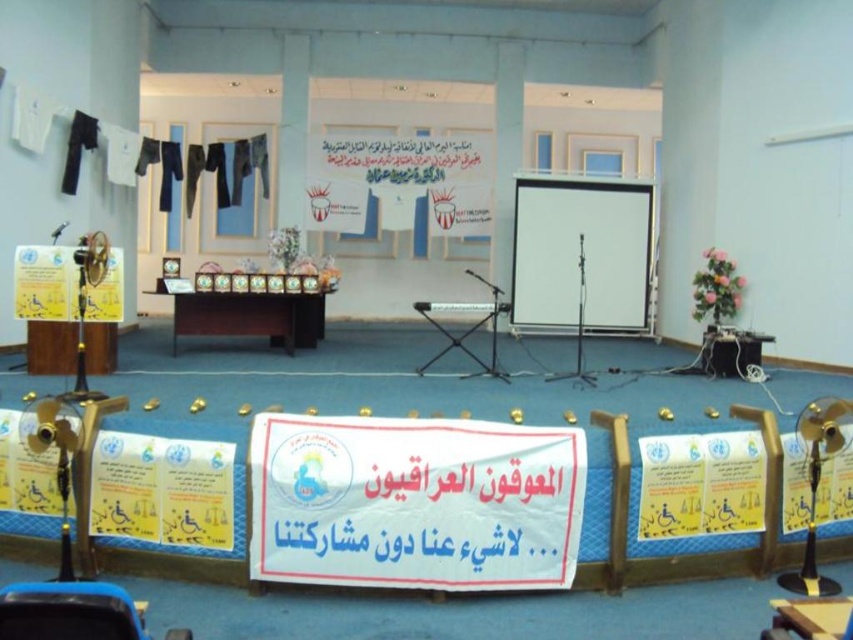
Is white matte projection screen at center bigger than wooden podium at center?

Indeed, white matte projection screen at center has a larger size compared to wooden podium at center.

Is white matte projection screen at center shorter than wooden podium at center?

No.

Who is more distant from viewer, (548, 316) or (184, 310)?

Positioned behind is point (548, 316).

Where is `white matte projection screen at center`? The image size is (853, 640). white matte projection screen at center is located at coordinates (579, 253).